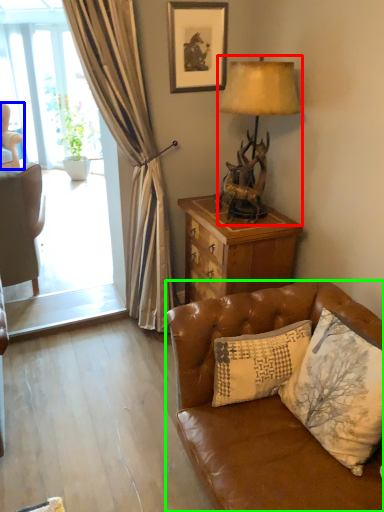
Question: Estimate the real-world distances between objects in this image. Which object is farther from lamp (highlighted by a red box), chair (highlighted by a blue box) or studio couch (highlighted by a green box)?

Choices:
 (A) chair
 (B) studio couch

Answer: (A)